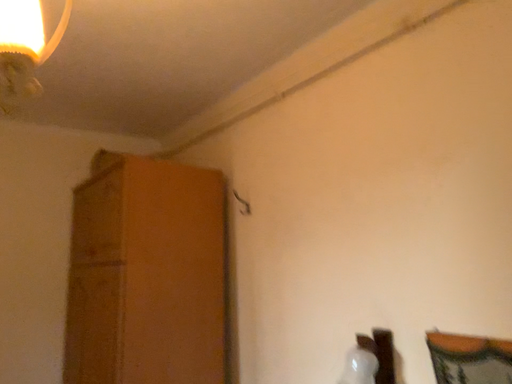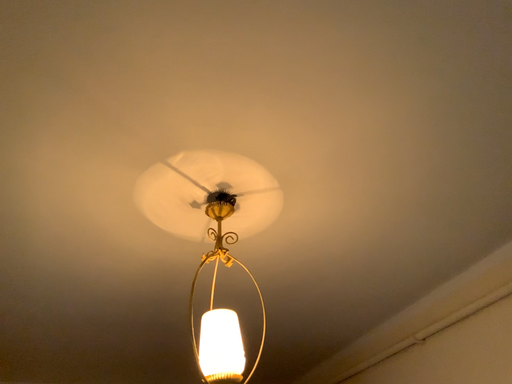
Question: Which way did the camera rotate in the video?

Choices:
 (A) rotated left
 (B) rotated right

Answer: (A)